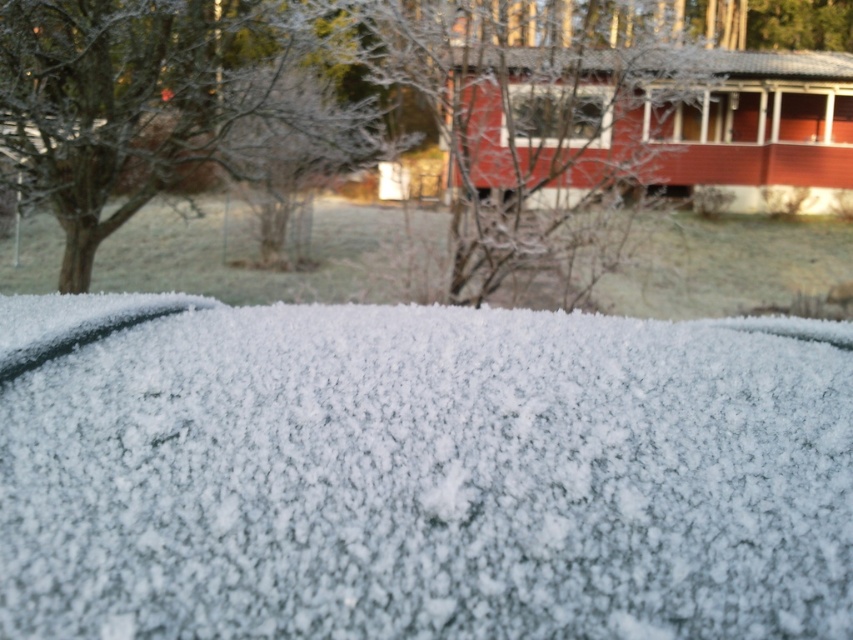
Does white crystalline frost at center have a greater height compared to transparent glass window at center?

In fact, white crystalline frost at center may be shorter than transparent glass window at center.

Is white crystalline frost at center closer to the viewer compared to transparent glass window at center?

Yes, it is in front of transparent glass window at center.

What do you see at coordinates (421, 472) in the screenshot? This screenshot has width=853, height=640. I see `white crystalline frost at center` at bounding box center [421, 472].

Image resolution: width=853 pixels, height=640 pixels. I want to click on white crystalline frost at center, so click(421, 472).